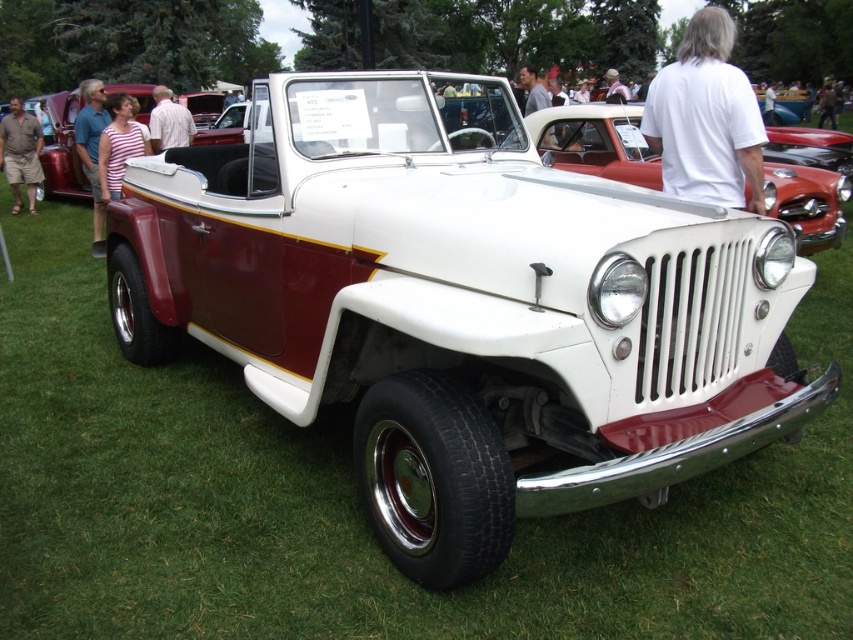
You are standing at the edge of the car show grassy area. You see a point marked at coordinates (595, 141). What object is located at that point?

The point at coordinates (595, 141) corresponds to the white matte jeep at center.

You are standing in front of the vintage Jeepster Commando at the car show. You notice an object labeled as the brown shorts at lower left. Where exactly is this object located in relation to the Jeep?

The brown shorts at lower left are located at the coordinates point (x=20, y=154) in relation to the Jeep.